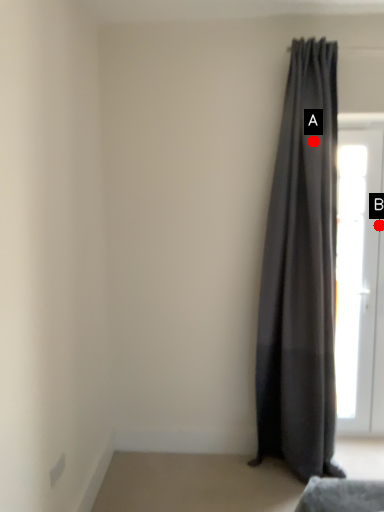
Question: Two points are circled on the image, labeled by A and B beside each circle. Which point is closer to the camera?

Choices:
 (A) A is closer
 (B) B is closer

Answer: (A)